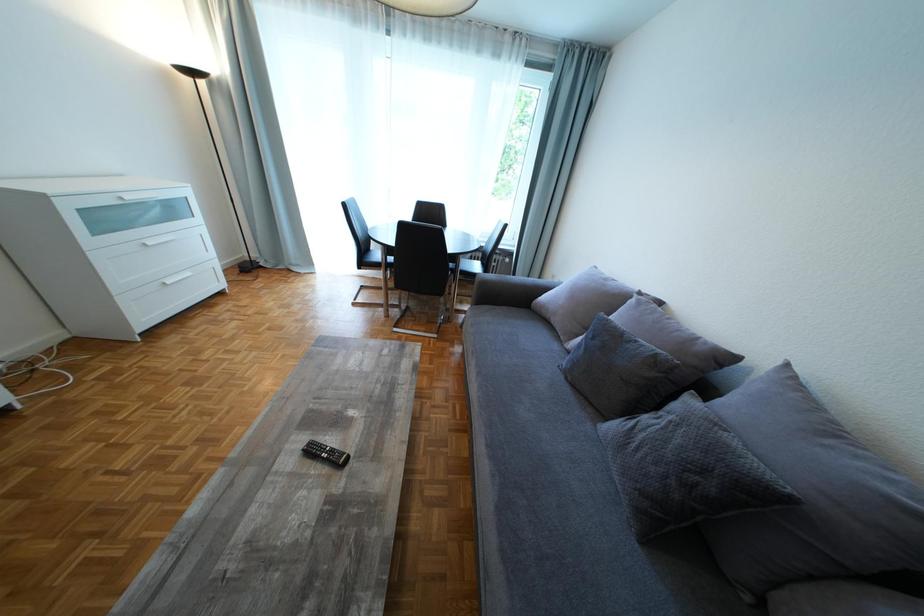
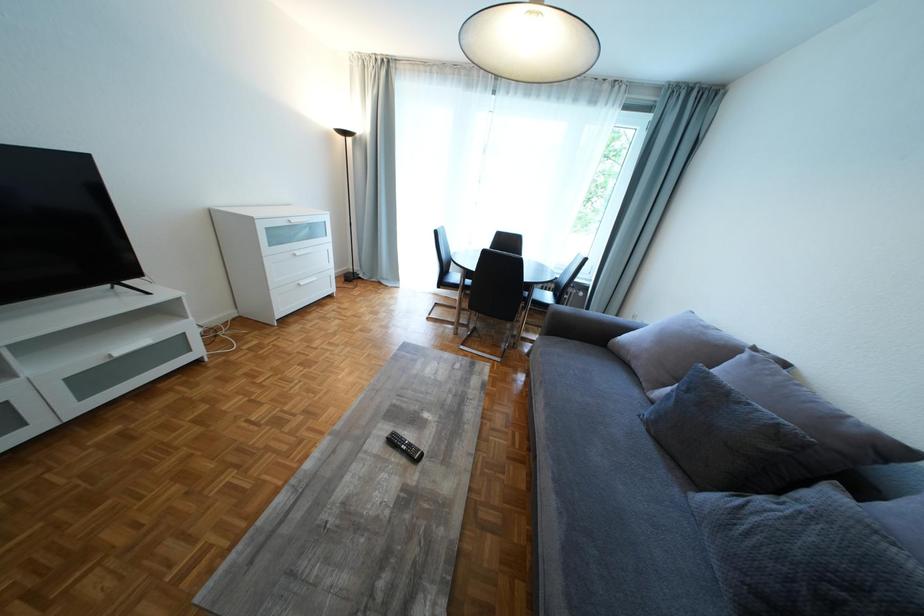
Question: The camera is either moving clockwise (left) or counter-clockwise (right) around the object. The first image is from the beginning of the video and the second image is from the end. Is the camera moving left or right when shooting the video?

Choices:
 (A) Left
 (B) Right

Answer: (B)